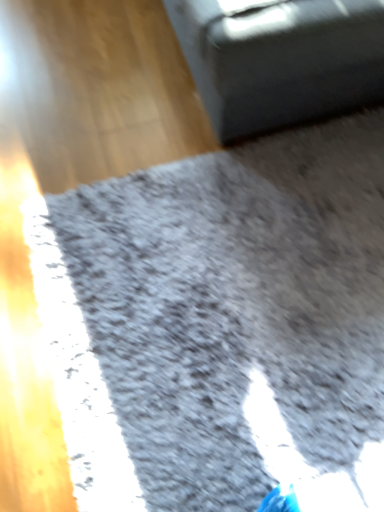
At what (x,y) coordinates should I click in order to perform the action: click on gray shaggy rug at center. Please return your answer as a coordinate pair (x, y). Looking at the image, I should click on (216, 323).

What is the approximate width of gray shaggy rug at center?

gray shaggy rug at center is 1.19 meters in width.

This screenshot has height=512, width=384. What do you see at coordinates (216, 323) in the screenshot?
I see `gray shaggy rug at center` at bounding box center [216, 323].

Identify the location of gray shaggy rug at center. The width and height of the screenshot is (384, 512). (216, 323).